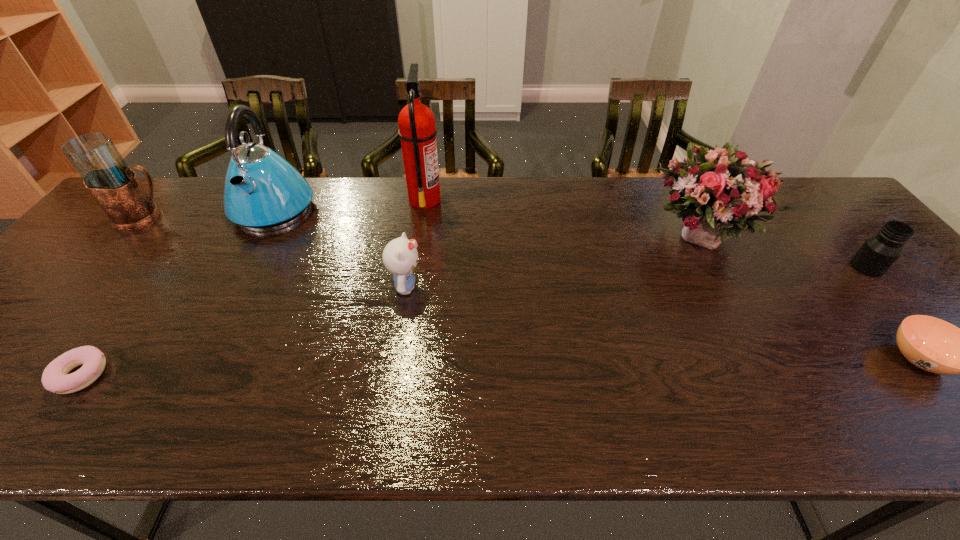
This screenshot has height=540, width=960. I want to click on object at the near edge, so click(x=55, y=378).

Locate an element on the screen. object that is positioned at the left edge is located at coordinates (114, 185).

Identify the location of object present at the right edge. (878, 253).

You are a GUI agent. You are given a task and a screenshot of the screen. Output one action in this format:
    pyautogui.click(x=<x>, y=<y>)
    Task: Click on the object that is positioned at the far left corner
    The height and width of the screenshot is (540, 960).
    Given the screenshot: What is the action you would take?
    pyautogui.click(x=114, y=185)

This screenshot has width=960, height=540. In the image, there is a desktop. What are the coordinates of `free space at the far edge` in the screenshot? It's located at (666, 224).

Find the location of a particular element. vacant space at the near edge of the desktop is located at coordinates (411, 438).

In the image, there is a desktop. At what (x,y) coordinates should I click in order to perform the action: click on free region at the far right corner. Please return your answer as a coordinate pair (x, y). Looking at the image, I should click on (792, 200).

This screenshot has width=960, height=540. Identify the location of empty space that is in between the pitcher and the kettle. (209, 213).

Where is `vacant area between the sixth object from right to left and the jar`? vacant area between the sixth object from right to left and the jar is located at coordinates (570, 237).

Where is `free spot between the kitten and the pitcher`? free spot between the kitten and the pitcher is located at coordinates (276, 252).